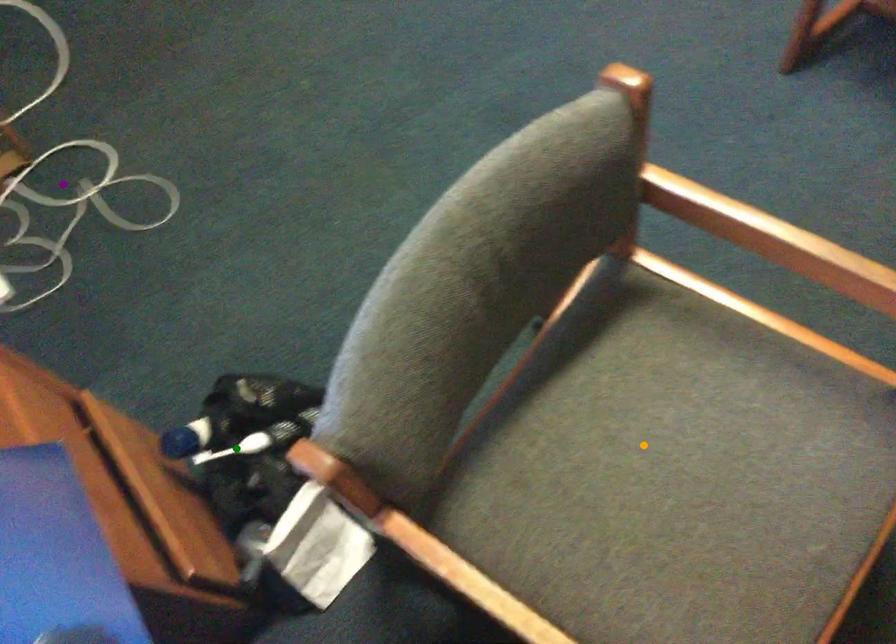
Order these from nearest to farthest:
1. purple point
2. green point
3. orange point

orange point → green point → purple point